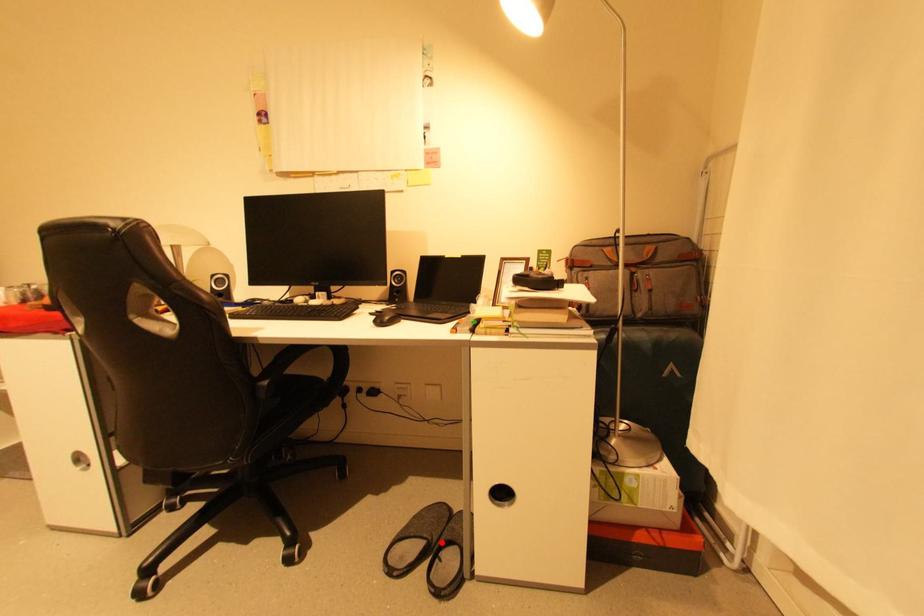
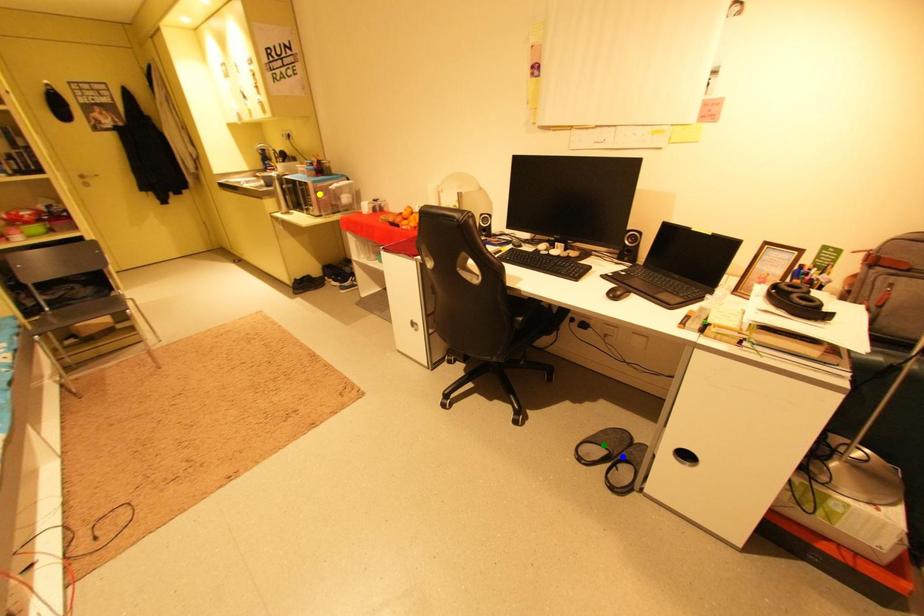
Question: I am providing you with two images of the same scene from different viewpoints. A red point is marked on the first image. You are given multiple points on the second image. Which mark in image 2 goes with the point in image 1?

Choices:
 (A) yellow point
 (B) green point
 (C) blue point

Answer: (C)